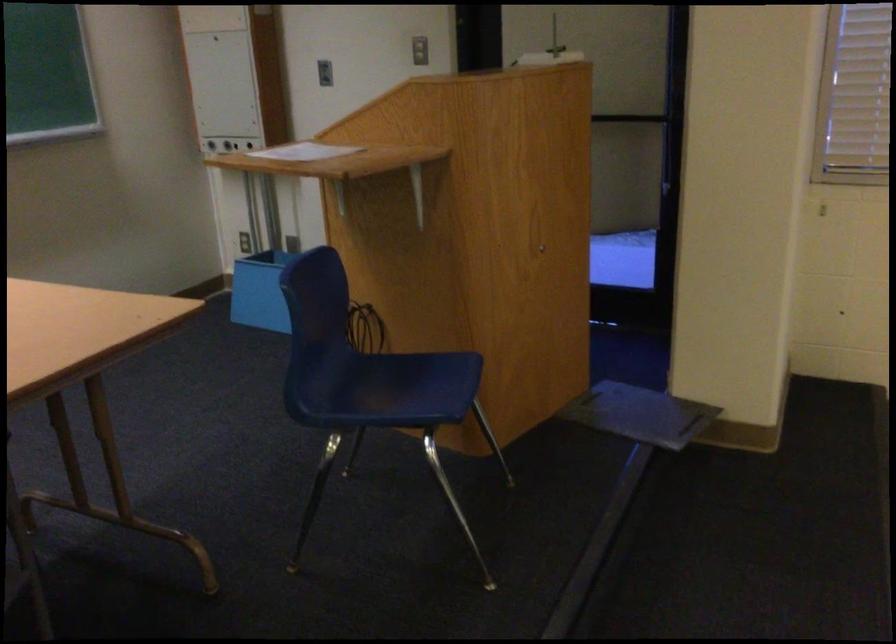
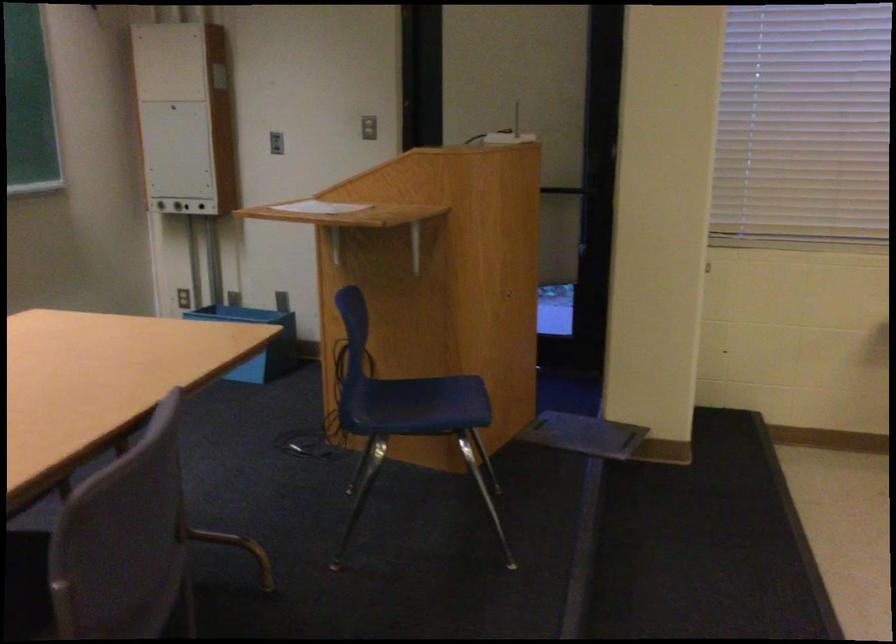
In the second image, find the point that corresponds to point 665,118 in the first image.

(583, 189)